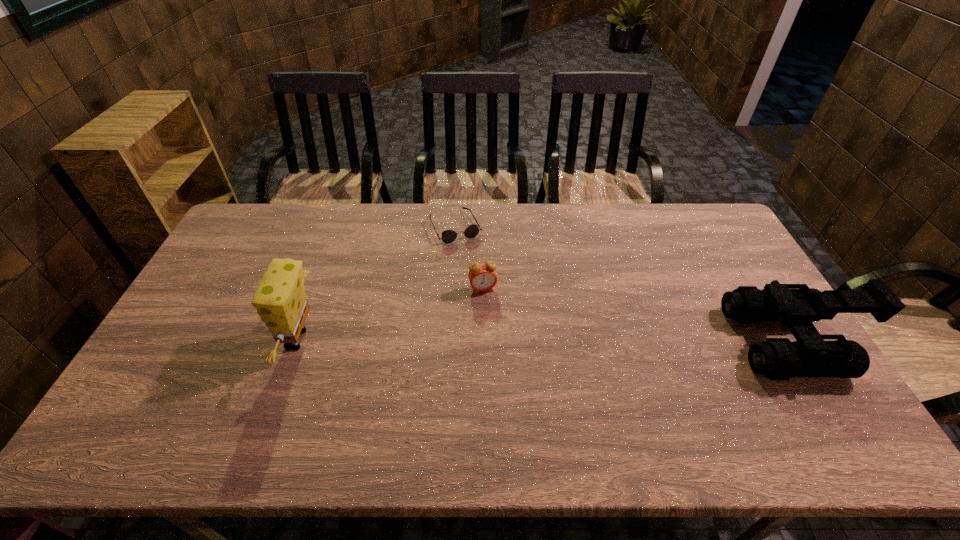
The image size is (960, 540). I want to click on free point located on the face of the leftmost object, so click(x=242, y=340).

Locate an element on the screen. This screenshot has height=540, width=960. free space located 0.160m on the front lenses of the binoculars is located at coordinates (678, 341).

Where is `vacant point located on the front lenses of the binoculars`? The height and width of the screenshot is (540, 960). vacant point located on the front lenses of the binoculars is located at coordinates (639, 341).

You are a GUI agent. You are given a task and a screenshot of the screen. Output one action in this format:
    pyautogui.click(x=<x>, y=<y>)
    Task: Click on the vacant space positioned on the front lenses of the binoculars
    This screenshot has width=960, height=540.
    Given the screenshot: What is the action you would take?
    pyautogui.click(x=628, y=341)

Where is `free space located on the face of the second farthest object`? This screenshot has height=540, width=960. free space located on the face of the second farthest object is located at coordinates (496, 339).

The image size is (960, 540). I want to click on vacant region located on the face of the second farthest object, so click(x=501, y=356).

Identify the location of vacant space situated 0.220m on the face of the second farthest object. The image size is (960, 540). (500, 353).

At what (x,y) coordinates should I click in order to perform the action: click on vacant space located 0.090m on the front-facing side of the shortest object. Please return your answer as a coordinate pair (x, y). This screenshot has height=540, width=960. Looking at the image, I should click on (472, 261).

Locate an element on the screen. The image size is (960, 540). vacant space located 0.290m on the front-facing side of the shortest object is located at coordinates (493, 303).

Where is `vacant space located 0.370m on the front-facing side of the shortest object`? The image size is (960, 540). vacant space located 0.370m on the front-facing side of the shortest object is located at coordinates (504, 323).